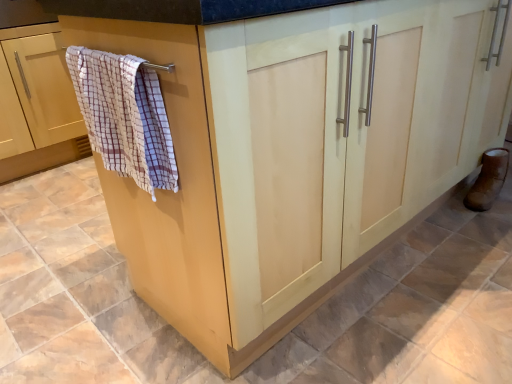
Question: Is beige wood towel rack at left further to the viewer compared to checkered fabric bath towel at left?

Choices:
 (A) no
 (B) yes

Answer: (B)

Question: Is beige wood towel rack at left completely or partially outside of checkered fabric bath towel at left?

Choices:
 (A) no
 (B) yes

Answer: (B)

Question: Does beige wood towel rack at left have a greater height compared to checkered fabric bath towel at left?

Choices:
 (A) yes
 (B) no

Answer: (A)

Question: Is checkered fabric bath towel at left completely or partially inside beige wood towel rack at left?

Choices:
 (A) yes
 (B) no

Answer: (B)

Question: Does beige wood towel rack at left appear on the right side of checkered fabric bath towel at left?

Choices:
 (A) no
 (B) yes

Answer: (A)

Question: Considering the positions of checkered fabric bath towel at left and brown leather boot at lower right in the image, is checkered fabric bath towel at left taller or shorter than brown leather boot at lower right?

Choices:
 (A) tall
 (B) short

Answer: (A)

Question: Considering the positions of point (157, 99) and point (483, 180), is point (157, 99) closer or farther from the camera than point (483, 180)?

Choices:
 (A) closer
 (B) farther

Answer: (A)

Question: From the image's perspective, is checkered fabric bath towel at left located above or below brown leather boot at lower right?

Choices:
 (A) above
 (B) below

Answer: (A)

Question: Looking at their shapes, would you say checkered fabric bath towel at left is wider or thinner than brown leather boot at lower right?

Choices:
 (A) wide
 (B) thin

Answer: (A)

Question: Considering the positions of point (502, 178) and point (29, 87), is point (502, 178) closer or farther from the camera than point (29, 87)?

Choices:
 (A) farther
 (B) closer

Answer: (B)

Question: In the image, is brown leather boot at lower right on the left side or the right side of beige wood towel rack at left?

Choices:
 (A) right
 (B) left

Answer: (A)

Question: Considering the positions of brown leather boot at lower right and beige wood towel rack at left in the image, is brown leather boot at lower right wider or thinner than beige wood towel rack at left?

Choices:
 (A) wide
 (B) thin

Answer: (B)

Question: From the image's perspective, is brown leather boot at lower right above or below beige wood towel rack at left?

Choices:
 (A) above
 (B) below

Answer: (B)

Question: From a real-world perspective, is brown leather boot at lower right physically located above or below checkered fabric bath towel at left?

Choices:
 (A) below
 (B) above

Answer: (A)

Question: Would you say brown leather boot at lower right is to the left or to the right of checkered fabric bath towel at left in the picture?

Choices:
 (A) right
 (B) left

Answer: (A)